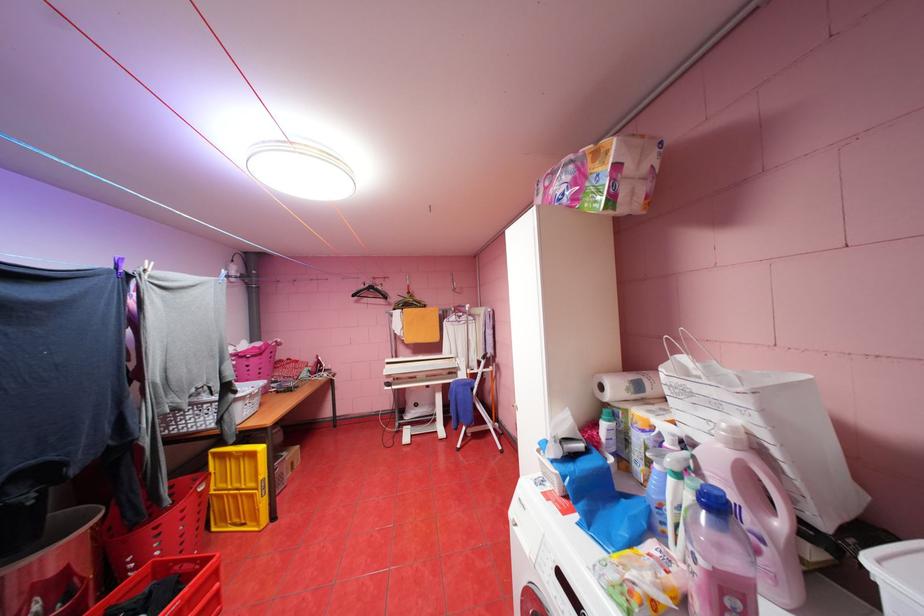
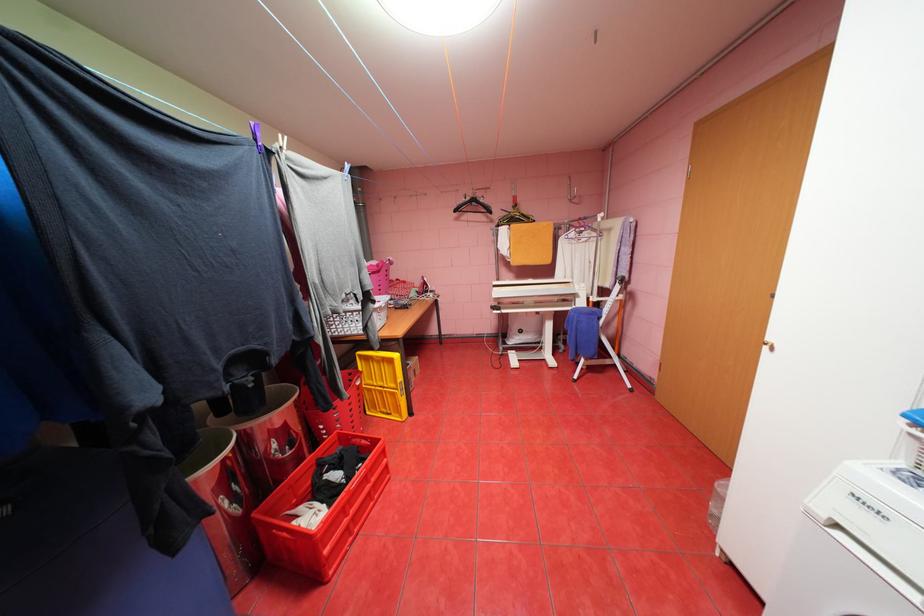
Find the pixel in the second image that matches point 472,428 in the first image.

(591, 360)